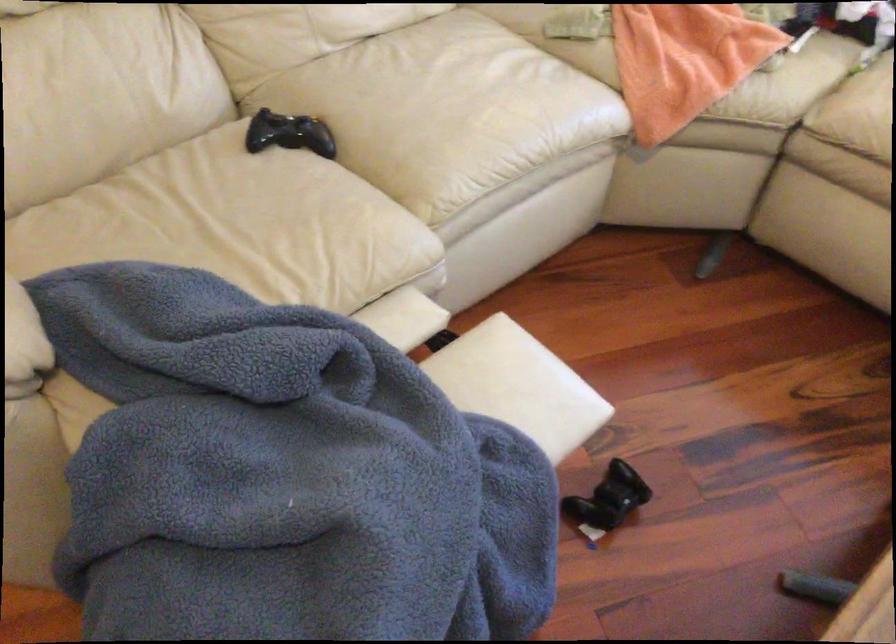
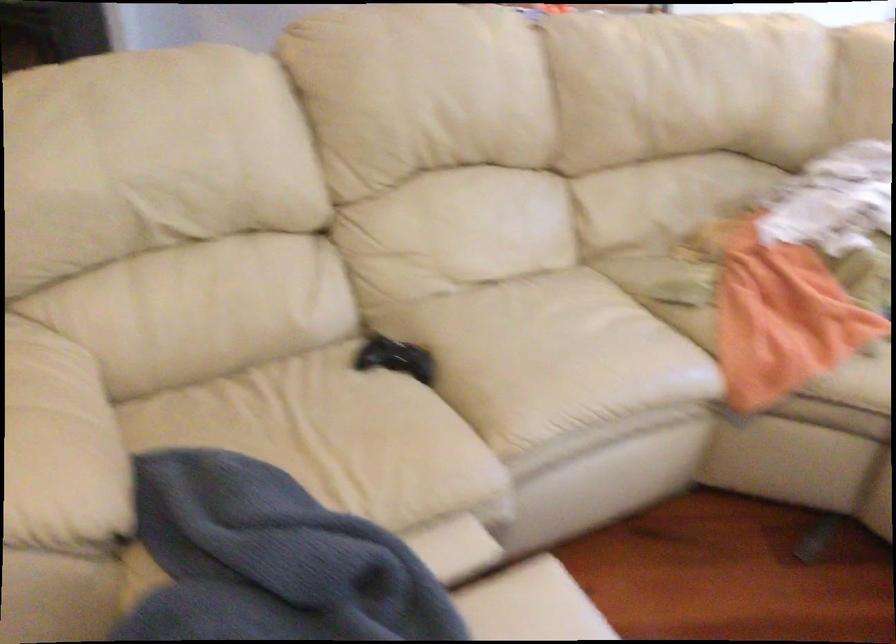
Question: How did the camera likely rotate?

Choices:
 (A) Left
 (B) Right
 (C) Up
 (D) Down

Answer: (C)